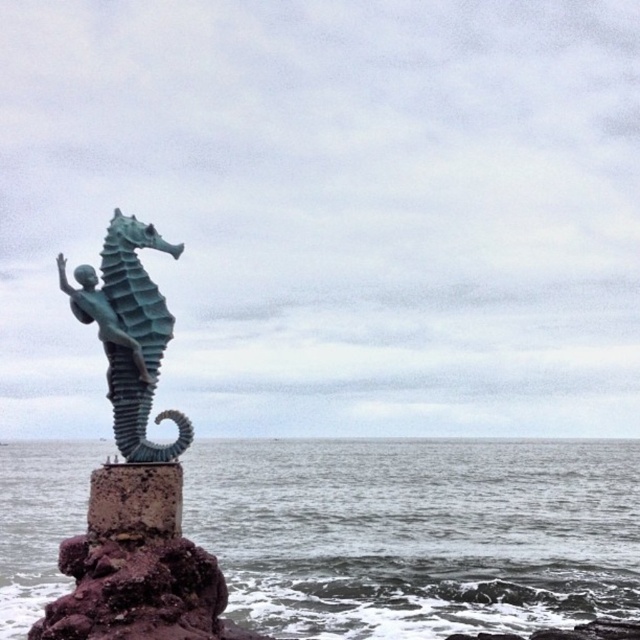
Question: Can you confirm if gray water at sea left is bigger than green patina seahorse at center?

Choices:
 (A) yes
 (B) no

Answer: (A)

Question: In this image, where is gray water at sea left located relative to green patina seahorse at center?

Choices:
 (A) left
 (B) right

Answer: (B)

Question: Is gray water at sea left to the right of green patina seahorse at center from the viewer's perspective?

Choices:
 (A) yes
 (B) no

Answer: (A)

Question: Which object is closer to the camera taking this photo?

Choices:
 (A) green patina seahorse at center
 (B) gray water at sea left

Answer: (A)